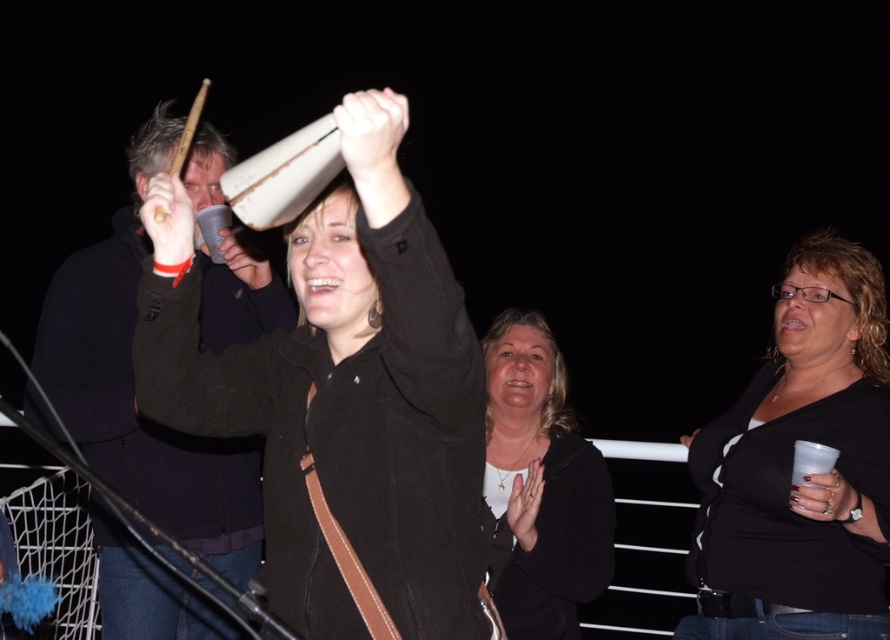
You are observing the image of a nighttime gathering and notice two items on the person at center. The items are the black matte shirt at center and the matte black jacket at center. Which item appears taller in the image?

The black matte shirt at center is much taller as matte black jacket at center, so the black matte shirt at center appears taller in the image.

You are organizing a clothing donation drive and need to determine if the black matte shirt at center and the matte black jacket at center can fit into a standard donation box that has a maximum capacity of 1 cubic foot. Based on their sizes, which item is more likely to fit comfortably?

The matte black jacket at center is smaller than the black matte shirt at center, so the matte black jacket at center is more likely to fit comfortably in the donation box.